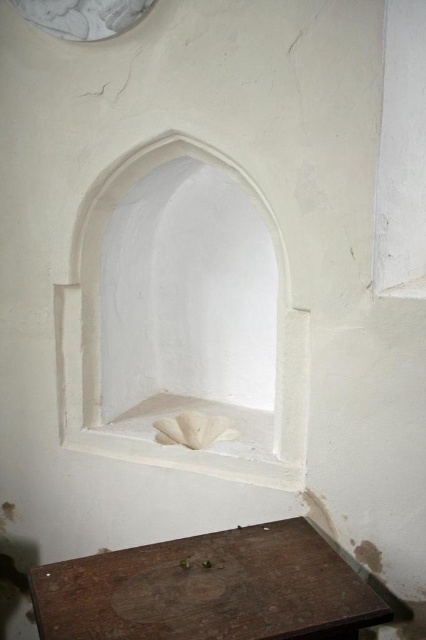
Between wooden table at lower right and white smooth stone niche at center, which one is positioned lower?

wooden table at lower right is below.

From the picture: Is wooden table at lower right thinner than white smooth stone niche at center?

In fact, wooden table at lower right might be wider than white smooth stone niche at center.

Image resolution: width=426 pixels, height=640 pixels. What do you see at coordinates (210, 589) in the screenshot? I see `wooden table at lower right` at bounding box center [210, 589].

Identify the location of wooden table at lower right. (210, 589).